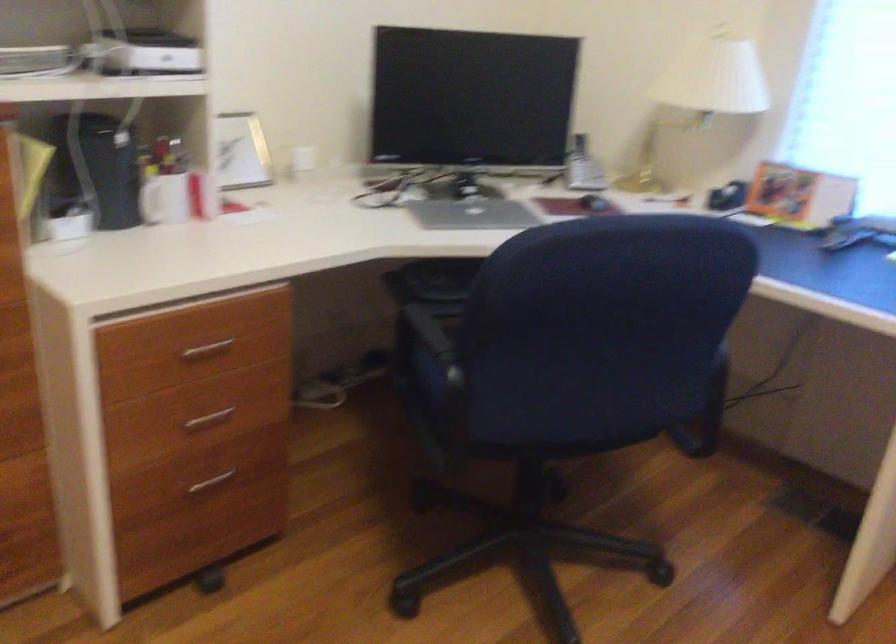
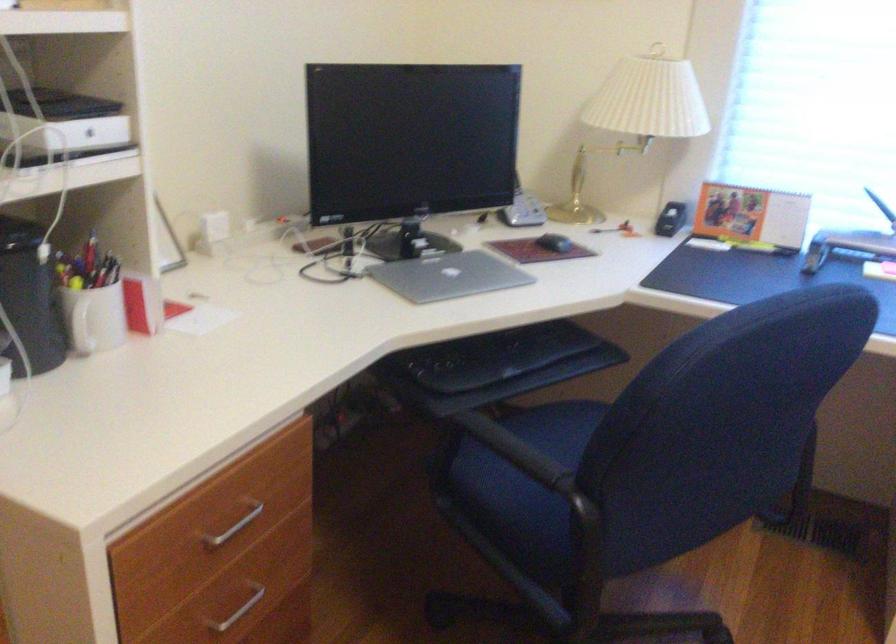
Where in the second image is the point corresponding to (143,204) from the first image?

(82, 328)